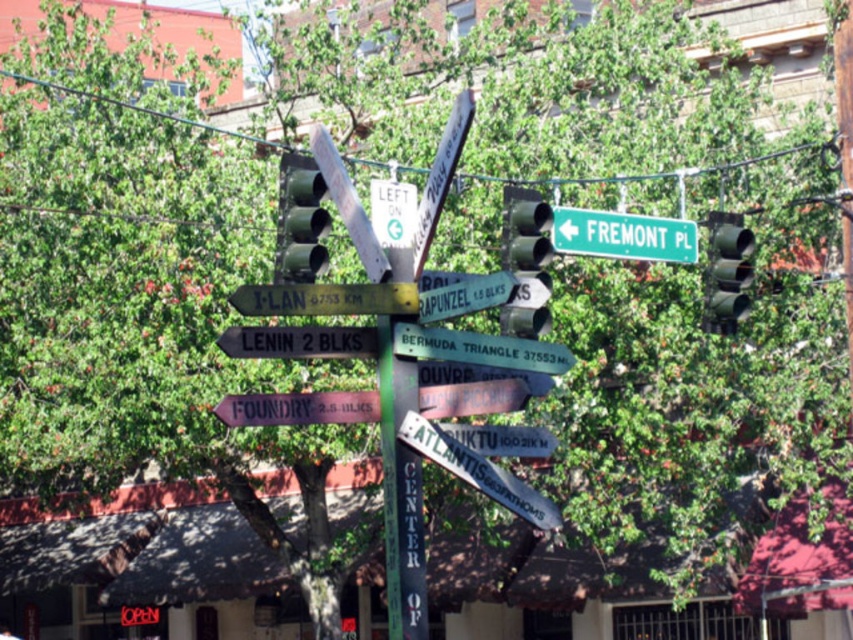
Based on the photo, you are a delivery driver needing to attach a large advertisement banner to either the white wooden signpost at center or the metallic green traffic light at upper right. Based on their sizes, which object would be more suitable for the banner?

The white wooden signpost at center has a larger width than the metallic green traffic light at upper right, so it would be more suitable for attaching the large advertisement banner.

You are a pedestrian standing at the intersection and want to know which object is closer to you between the green matte traffic light at upper center and the white plastic signpost at upper center. Please answer based on their positions.

The green matte traffic light at upper center is closer to you because it is further to the viewer than the white plastic signpost at upper center, meaning it appears nearer in the scene.

What is the relationship between the sizes of the white plastic sign at lower left and the metallic silver sign at center?

The white plastic sign at lower left is larger in size than the metallic silver sign at center.